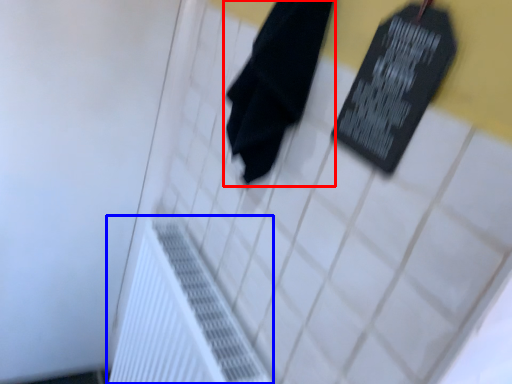
Question: Which object appears closest to the camera in this image, towel (highlighted by a red box) or radiator (highlighted by a blue box)?

Choices:
 (A) towel
 (B) radiator

Answer: (A)